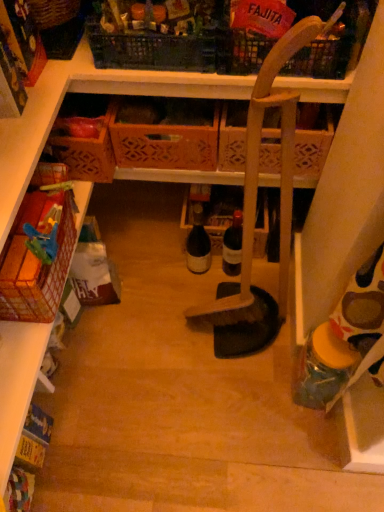
Question: In terms of width, does translucent plastic jar at lower right, acting as the second bottle starting from the top, look wider or thinner when compared to plastic crate at upper center, marked as the fourth basket in a bottom-to-top arrangement?

Choices:
 (A) wide
 (B) thin

Answer: (B)

Question: In the image, is translucent plastic jar at lower right, which is the first bottle in right-to-left order, positioned in front of or behind plastic crate at upper center, which is the third basket from top to bottom?

Choices:
 (A) behind
 (B) front

Answer: (A)

Question: Which object is the closest to the plastic crate at upper center, which is the third basket from top to bottom?

Choices:
 (A) woven brown basket at upper left, which is counted as the 5th basket, starting from the bottom
 (B) wooden crate at center, the 5th basket positioned from the top
 (C) wooden broom at center
 (D) red plastic basket at upper center, positioned as the 6th basket in bottom-to-top order
 (E) red mesh basket at left, which ranks as the first basket in bottom-to-top order

Answer: (D)

Question: Considering the real-world distances, which object is farthest from the woven brown basket at upper left, placed as the 2th basket when sorted from top to bottom?

Choices:
 (A) wooden crate at center, which is counted as the 3th basket, starting from the bottom
 (B) translucent plastic jar at lower right, positioned as the first bottle in front-to-back order
 (C) matte glass bottle at center, the 1th bottle from the top
 (D) red plastic basket at upper center, positioned as the first basket in top-to-bottom order
 (E) wooden broom at center

Answer: (B)